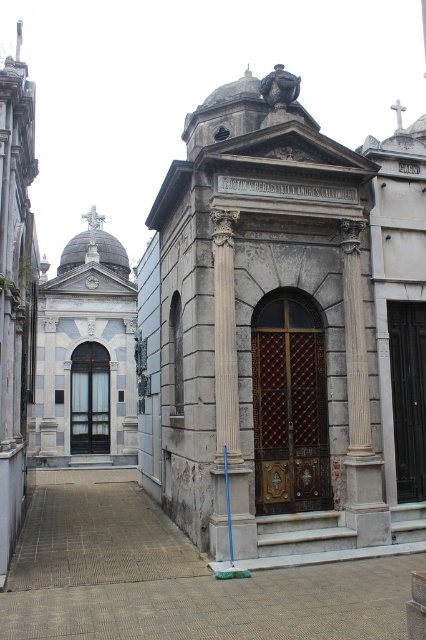
Between point (233, 298) and point (365, 458), which one is positioned in front?

Point (233, 298) is more forward.

From the picture: Can you confirm if white marble column at center is positioned to the left of white stone column at center?

Yes, white marble column at center is to the left of white stone column at center.

Describe the element at coordinates (227, 403) in the screenshot. Image resolution: width=426 pixels, height=640 pixels. I see `white marble column at center` at that location.

At what (x,y) coordinates should I click in order to perform the action: click on white marble column at center. Please return your answer as a coordinate pair (x, y). This screenshot has height=640, width=426. Looking at the image, I should click on [x=227, y=403].

Can you confirm if brown polished wood door at center is positioned to the right of dark brown wooden door at center?

In fact, brown polished wood door at center is to the left of dark brown wooden door at center.

Which is behind, point (270, 468) or point (408, 324)?

The point (408, 324) is more distant.

Which is behind, point (265, 384) or point (400, 332)?

Positioned behind is point (400, 332).

Locate an element on the screen. This screenshot has width=426, height=640. brown polished wood door at center is located at coordinates (290, 404).

Who is shorter, smooth gray stone church at left or matte glass door at center?

matte glass door at center

Between smooth gray stone church at left and matte glass door at center, which one has more height?

smooth gray stone church at left

Is point (5, 476) less distant than point (74, 429)?

Yes, it is.

I want to click on smooth gray stone church at left, so click(x=16, y=291).